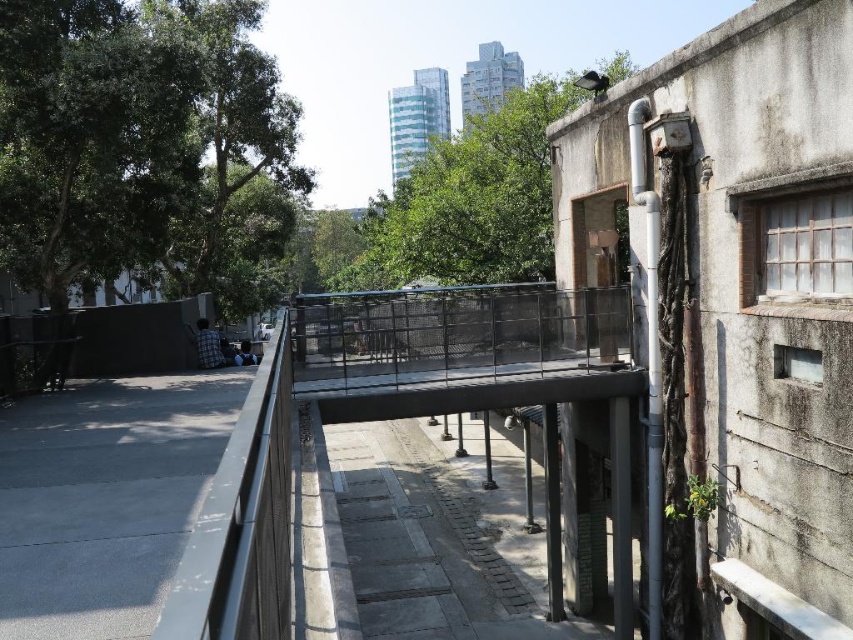
Consider the image. You are a painter standing at the end of the alleyway looking towards the bridge. You want to paint both the green leafy tree at left and the green leafy tree at center. Which tree should you focus on first if you want to capture the wider tree in your painting?

The green leafy tree at center is wider than the green leafy tree at left, so you should focus on painting the green leafy tree at center first to capture its wider structure.

You are standing at the pedestrian bridge looking down into the alleyway. There is a specific point marked at coordinates point (96, 212). If you want to throw a small object to land precisely at that point, considering the bridge is 34.86 feet above the ground, would you need to aim higher or lower than the point to compensate for the distance?

The point (96, 212) is 34.86 feet from the viewer. To compensate for the distance, you would need to aim higher than the point to ensure the object reaches it.